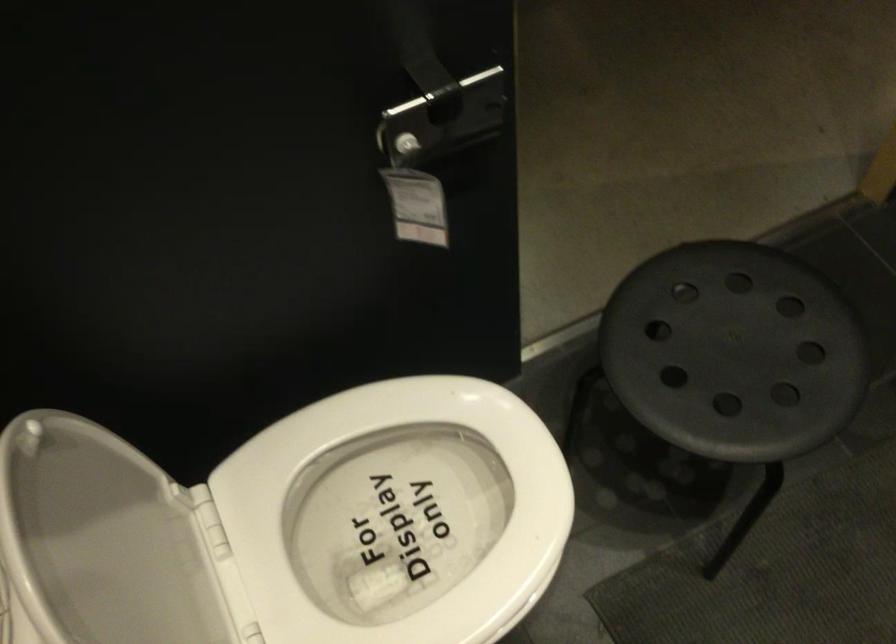
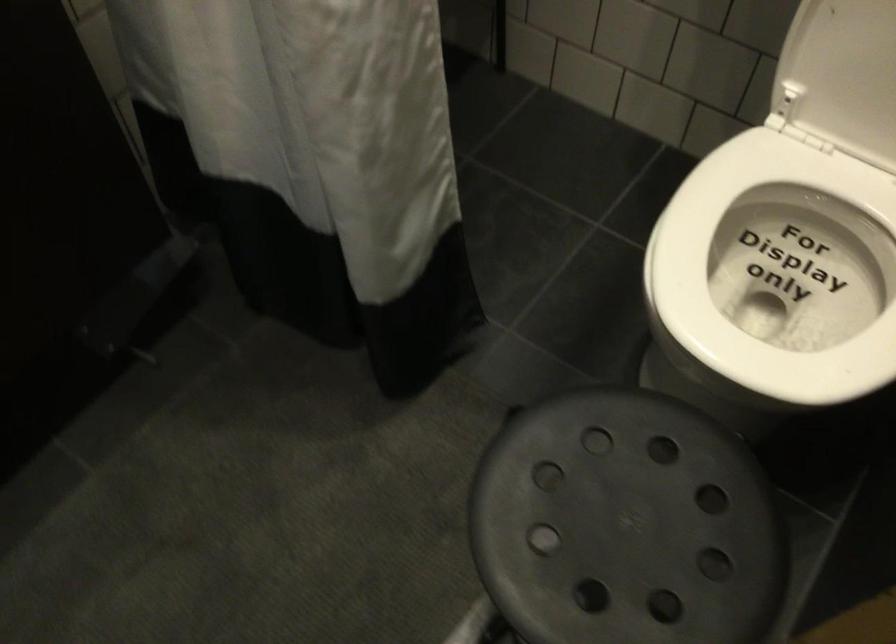
Find the pixel in the second image that matches pixel 705 321 in the first image.

(625, 525)